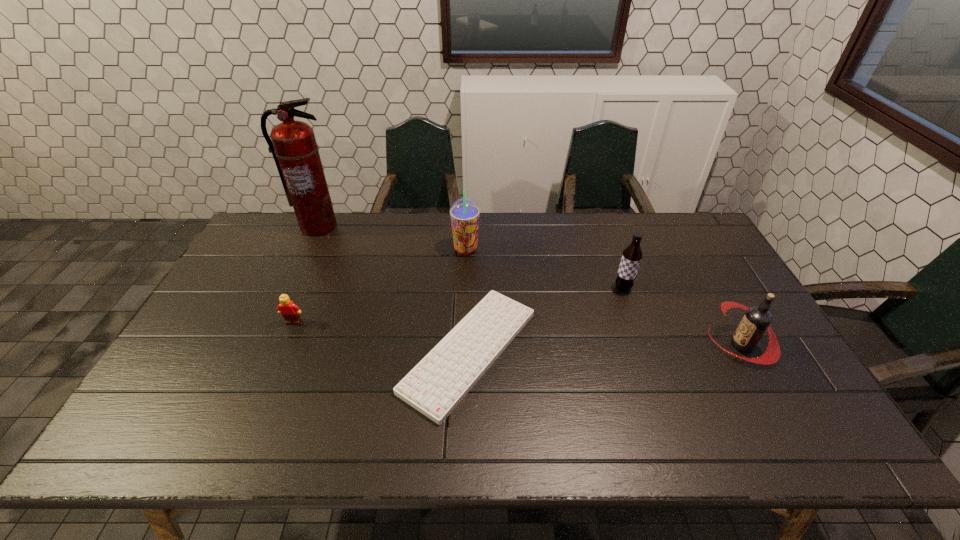
Where is `the tallest object`? the tallest object is located at coordinates (295, 151).

The height and width of the screenshot is (540, 960). Find the location of `fire extinguisher`. fire extinguisher is located at coordinates (295, 151).

Find the location of a particular element. The height and width of the screenshot is (540, 960). smoothie is located at coordinates (464, 213).

I want to click on the farther root beer, so click(x=631, y=257).

At what (x,y) coordinates should I click in order to perform the action: click on the second object from right to left. Please return your answer as a coordinate pair (x, y). The image size is (960, 540). Looking at the image, I should click on [x=631, y=257].

Identify the location of the rightmost object. pyautogui.click(x=757, y=319).

Identify the location of the right root beer. This screenshot has width=960, height=540. (757, 319).

The height and width of the screenshot is (540, 960). Identify the location of the fifth tallest object. (290, 311).

Locate an element on the screen. This screenshot has width=960, height=540. computer keyboard is located at coordinates [x=436, y=385].

Find the location of a particular element. The height and width of the screenshot is (540, 960). free space located 0.300m on the side of the farthest object with the handle and hose is located at coordinates (285, 297).